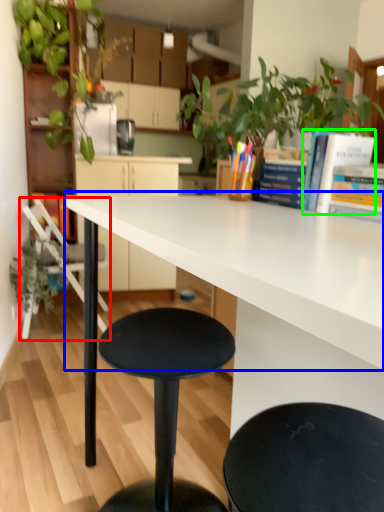
Question: Which object is the closest to the chair (highlighted by a red box)? Choose among these: countertop (highlighted by a blue box) or book (highlighted by a green box).

Choices:
 (A) countertop
 (B) book

Answer: (A)